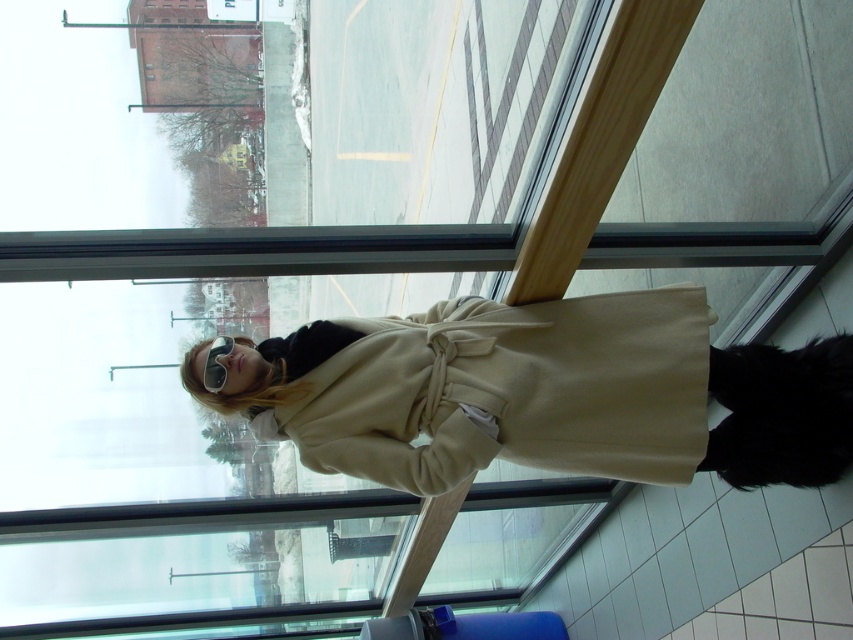
What are the coordinates of the beige wool coat at center in the image?

The beige wool coat at center is located at point [547,394].

From the picture: You are trying to determine if the beige wool coat at center can fit into a storage box designed for items narrower than the matte black goggles at center. Based on the scene, will the coat fit?

The beige wool coat at center is wider than the matte black goggles at center, so it will not fit into a storage box designed for items narrower than the matte black goggles at center.

You are a fashion designer observing the beige wool coat at center and the matte black goggles at center. Which item is positioned lower on the person?

The beige wool coat at center is positioned lower than the matte black goggles at center.